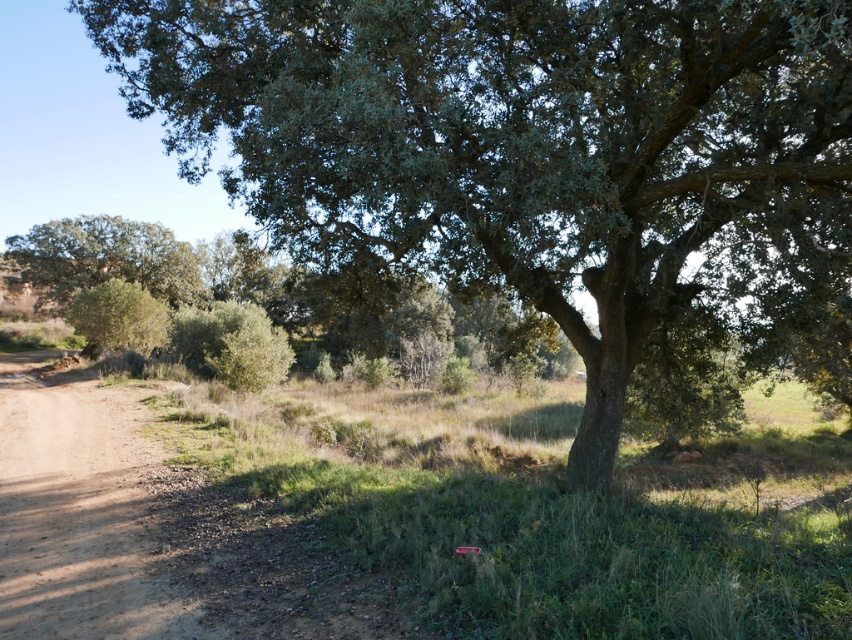
Can you confirm if green leafy tree at center is smaller than brown dirt track at lower left?

No.

Is point (536, 276) in front of point (49, 573)?

No, it is not.

At what (x,y) coordinates should I click in order to perform the action: click on green leafy tree at center. Please return your answer as a coordinate pair (x, y). This screenshot has width=852, height=640. Looking at the image, I should click on (521, 147).